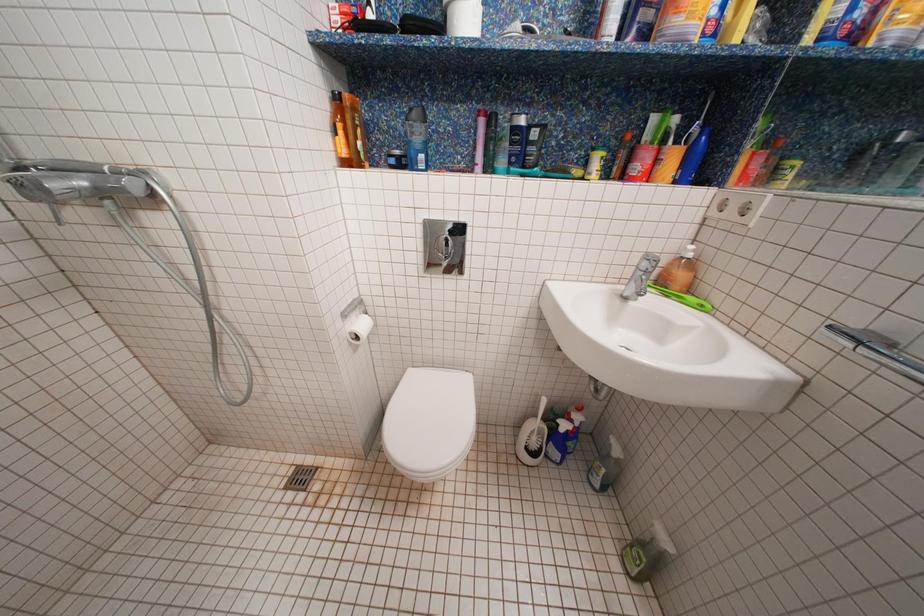
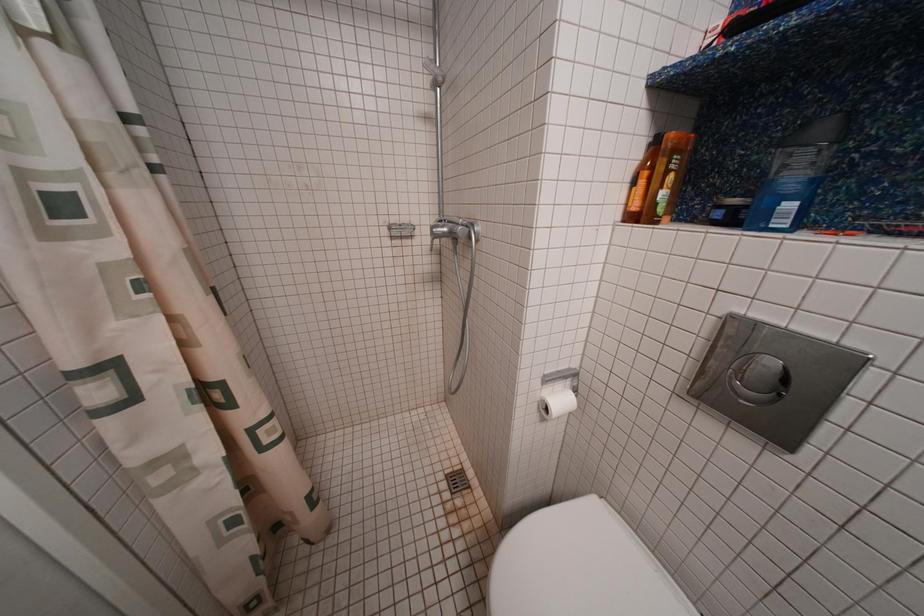
Question: The first image is from the beginning of the video and the second image is from the end. How did the camera likely rotate when shooting the video?

Choices:
 (A) Left
 (B) Right
 (C) Up
 (D) Down

Answer: (A)